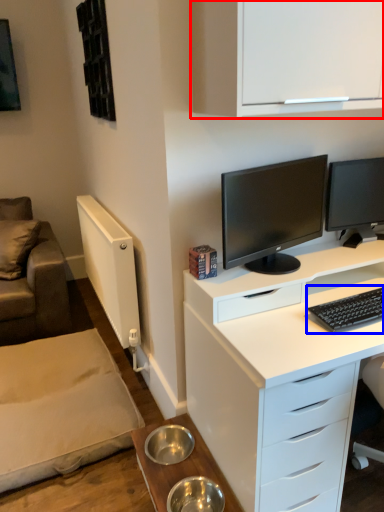
Question: Which of the following is the closest to the observer, cabinetry (highlighted by a red box) or computer keyboard (highlighted by a blue box)?

Choices:
 (A) cabinetry
 (B) computer keyboard

Answer: (A)